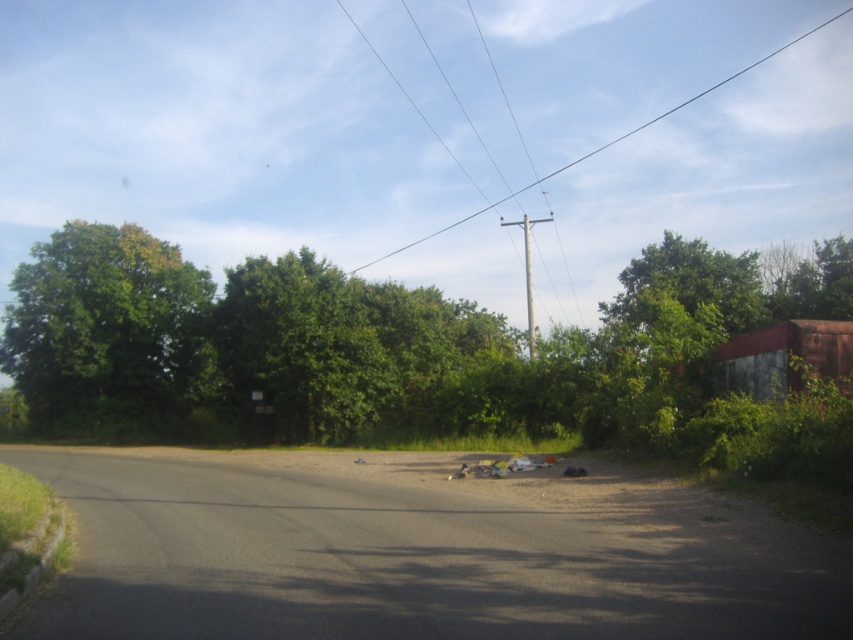
Question: Is green leafy tree at left below smooth wire at upper center?

Choices:
 (A) yes
 (B) no

Answer: (A)

Question: Does green leafy tree at left appear under metallic wire at upper center?

Choices:
 (A) no
 (B) yes

Answer: (B)

Question: Which object is closer to the camera taking this photo?

Choices:
 (A) smooth wire at upper center
 (B) green leafy tree at left
 (C) green leafy tree at center
 (D) metallic wire at upper center

Answer: (C)

Question: Which point appears farthest from the camera in this image?

Choices:
 (A) (405, 97)
 (B) (154, 356)
 (C) (633, 132)
 (D) (506, 342)

Answer: (C)

Question: Is smooth wire at upper center to the left of metallic wire at upper center from the viewer's perspective?

Choices:
 (A) no
 (B) yes

Answer: (A)

Question: Estimate the real-world distances between objects in this image. Which object is closer to the green leafy tree at left?

Choices:
 (A) green leafy tree at center
 (B) metallic wire at upper center

Answer: (A)